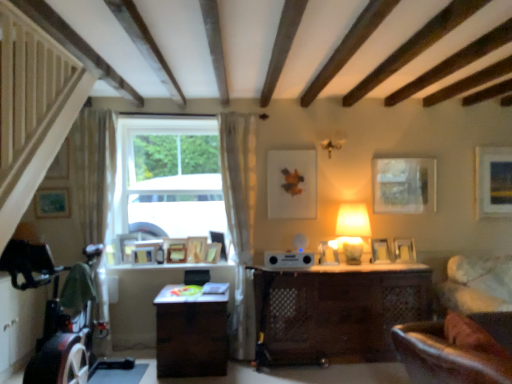
Question: In terms of size, does matte gold picture frame at upper right, the 1th picture frame positioned from the right, appear bigger or smaller than wooden picture frame at center, which is the 6th picture frame from left to right?

Choices:
 (A) small
 (B) big

Answer: (B)

Question: From the image's perspective, is matte gold picture frame at upper right, the 1th picture frame positioned from the right, above or below wooden picture frame at center, which is the 6th picture frame from left to right?

Choices:
 (A) above
 (B) below

Answer: (A)

Question: Which object is the farthest from the wooden picture frame at center, the eighth picture frame when ordered from left to right?

Choices:
 (A) wooden picture frame at center, which is counted as the 5th picture frame, starting from the left
 (B) white sheer curtain at left, the 2th curtain from the right
 (C) brown wooden desk at center
 (D) wooden picture frame at center, acting as the 8th picture frame starting from the right
 (E) matte blue picture frame at upper left, acting as the first picture frame starting from the left

Answer: (E)

Question: Which object is the closest to the velvet green swivel chair at lower right?

Choices:
 (A) wooden picture frame at center, which is the 6th picture frame from left to right
 (B) matte silver picture frame at right, placed as the tenth picture frame when sorted from left to right
 (C) brown wooden desk at center
 (D) matte gold picture frame at upper right, the thirteenth picture frame in the left-to-right sequence
 (E) wooden picture frame at lower left, the 12th picture frame when ordered from right to left

Answer: (C)